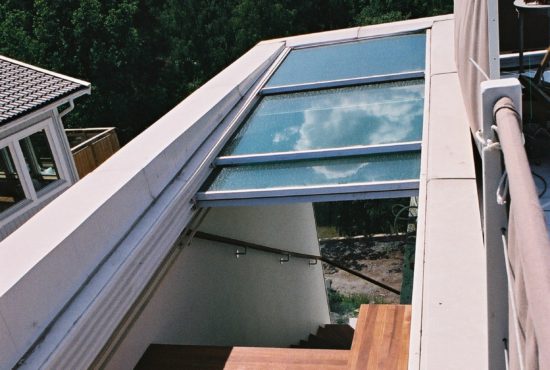
At what (x,y) coordinates should I click in order to perform the action: click on wall. Please return your answer as a coordinate pair (x, y). Looking at the image, I should click on (450, 255).